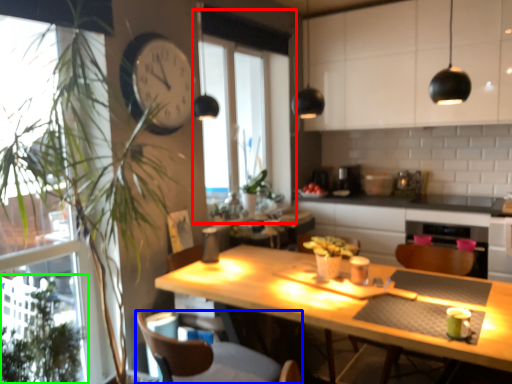
Question: Considering the real-world distances, which object is farthest from window (highlighted by a red box)? swivel chair (highlighted by a blue box) or plant (highlighted by a green box)?

Choices:
 (A) swivel chair
 (B) plant

Answer: (B)